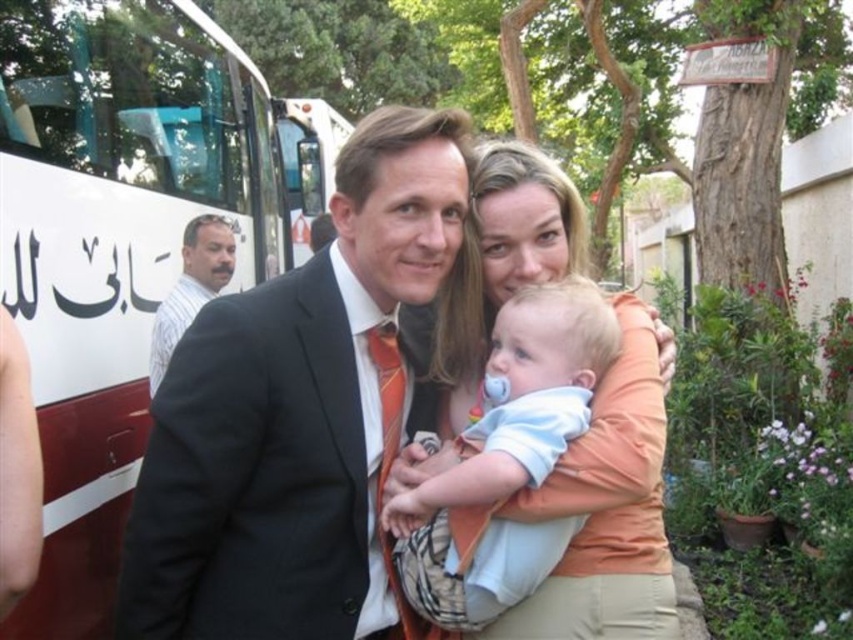
Based on the scene description, where is the black suit at center located in terms of coordinates?

The black suit at center is located at coordinates point (297, 413).

Based on the scene description, where is the black suit at center located in terms of coordinates?

The black suit at center is located at coordinates point (297, 413).